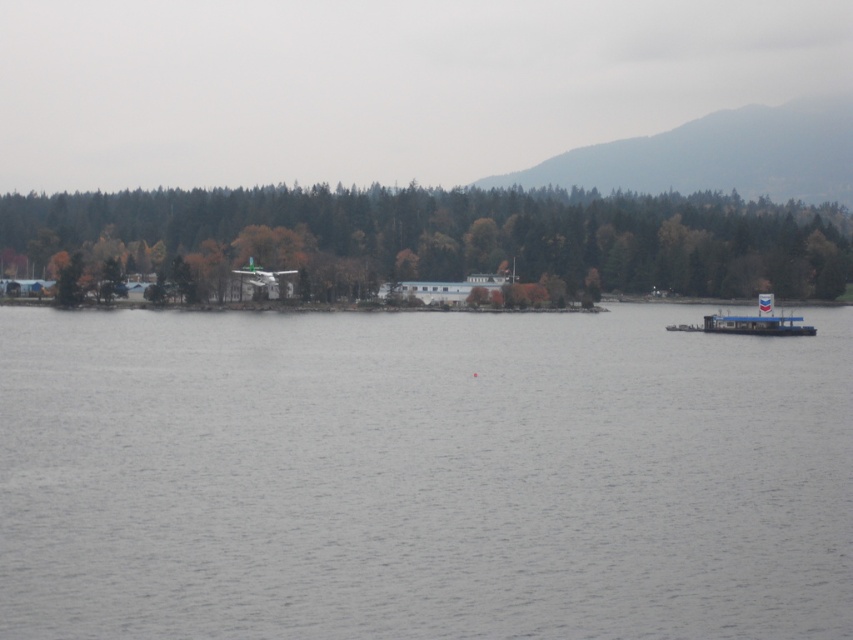
You are a photographer planning to capture the gray water at center and the blue plastic boat at right in a single frame. Given that your camera has a fixed focal length, which object should you position closer to the center of the frame to ensure both fit within the shot?

Since the gray water at center is wider than the blue plastic boat at right, positioning the gray water at center closer to the frame center would allow both to fit better within the shot.

You are standing at the point marked by the coordinates (457, 236) in the lakeside scene. What object is exactly at this location?

The green matte tree at center is located at point (457, 236).